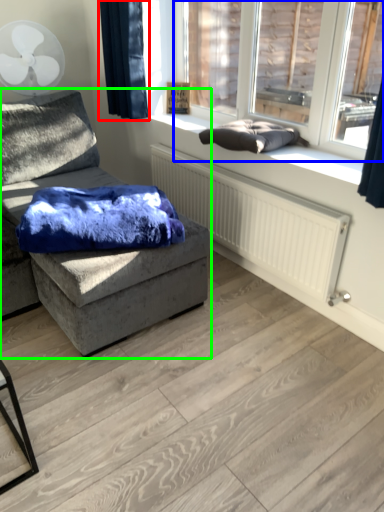
Question: Which object is positioned closest to curtain (highlighted by a red box)? Select from window (highlighted by a blue box) and studio couch (highlighted by a green box).

Choices:
 (A) window
 (B) studio couch

Answer: (B)